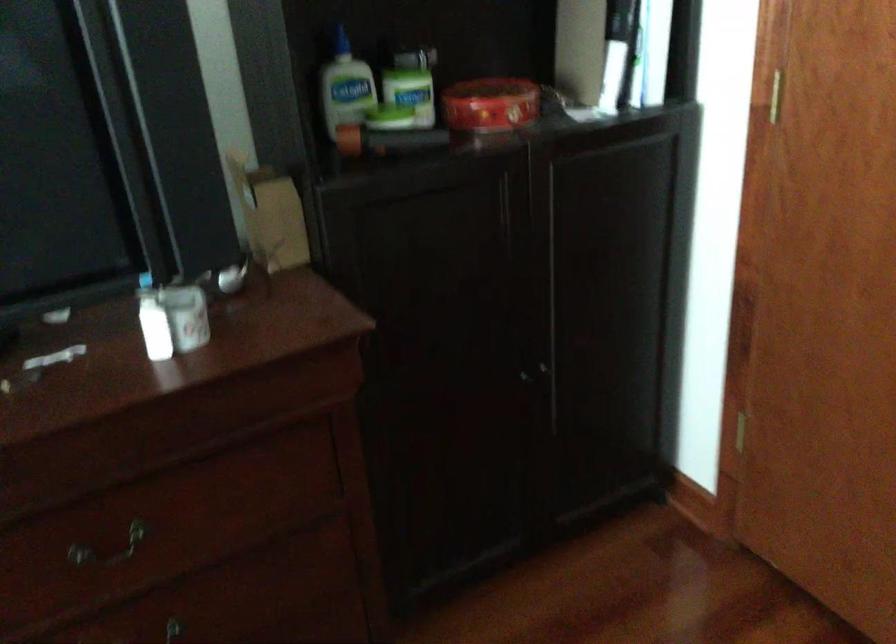
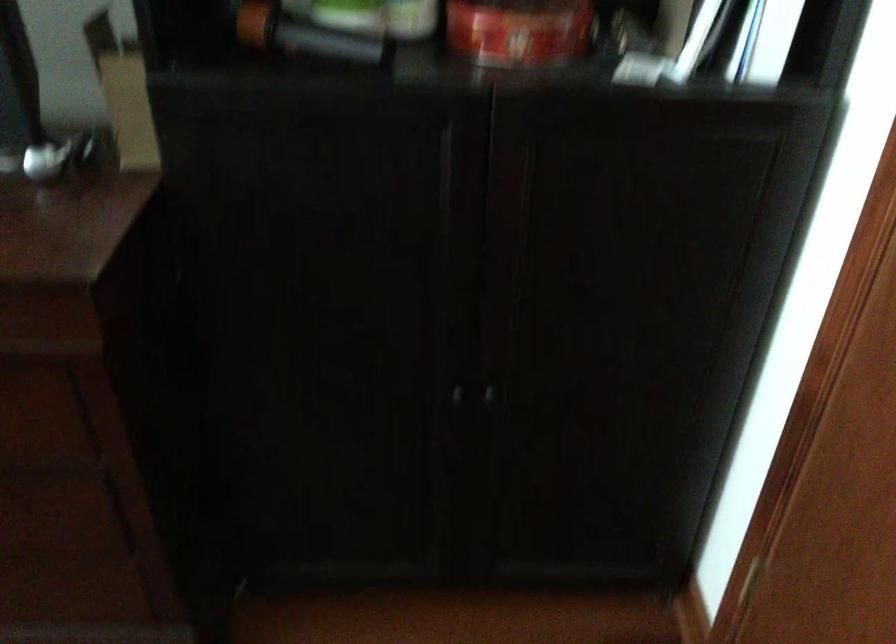
The point at (523, 379) is marked in the first image. Where is the corresponding point in the second image?

(457, 395)